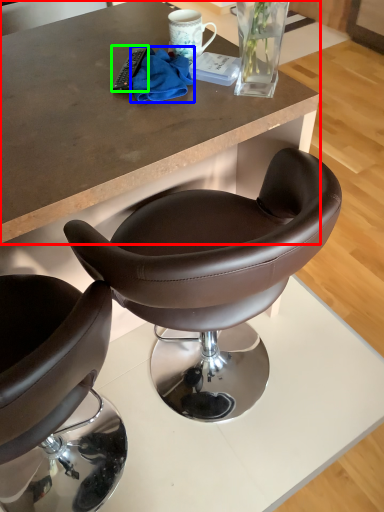
Question: Which object is positioned farthest from desk (highlighted by a red box)? Select from material (highlighted by a blue box) and remote control (highlighted by a green box).

Choices:
 (A) material
 (B) remote control

Answer: (B)